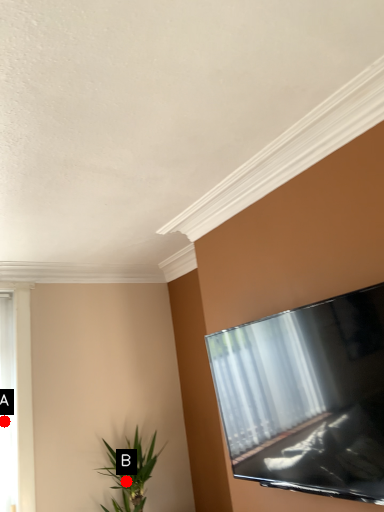
Question: Two points are circled on the image, labeled by A and B beside each circle. Which point is closer to the camera taking this photo?

Choices:
 (A) A is closer
 (B) B is closer

Answer: (B)